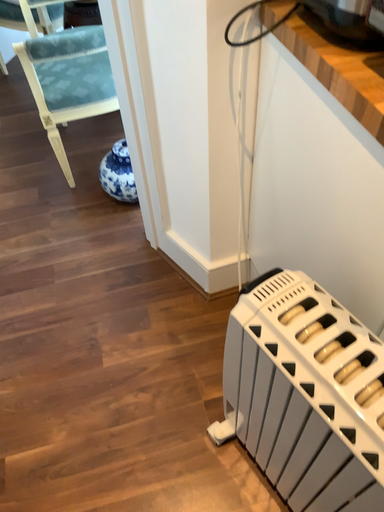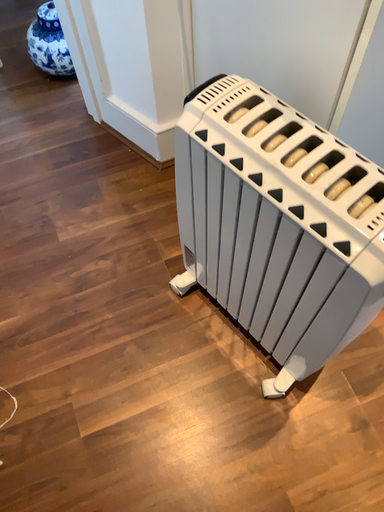
Question: How did the camera likely rotate when shooting the video?

Choices:
 (A) rotated upward
 (B) rotated downward

Answer: (B)